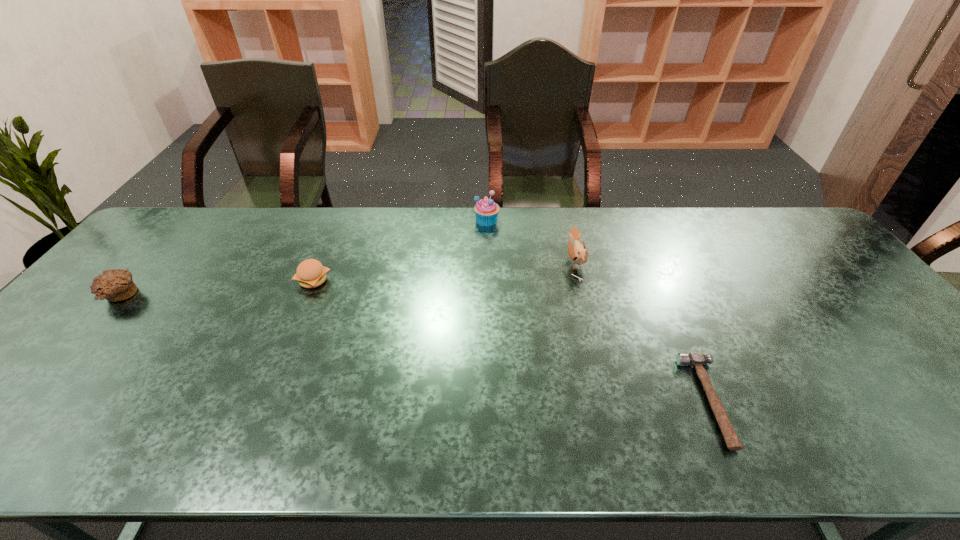
Locate an element on the screen. the farther muffin is located at coordinates (486, 210).

In order to click on the farthest object in this screenshot , I will do [x=486, y=210].

Where is `the second object from right to left`? Image resolution: width=960 pixels, height=540 pixels. the second object from right to left is located at coordinates (578, 253).

Find the location of `the leftmost object`. the leftmost object is located at coordinates (114, 285).

This screenshot has width=960, height=540. In order to click on the left muffin in this screenshot , I will do `click(114, 285)`.

The height and width of the screenshot is (540, 960). Identify the location of hamburger. (310, 273).

This screenshot has width=960, height=540. I want to click on the nearest object, so click(x=695, y=359).

Locate an element on the screen. This screenshot has width=960, height=540. the shortest object is located at coordinates (695, 359).

At what (x,y) coordinates should I click in order to perform the action: click on vacant space located 0.080m on the front of the farthest object. Please return your answer as a coordinate pair (x, y). Looking at the image, I should click on (488, 242).

This screenshot has width=960, height=540. What are the coordinates of `free region located at the beak of the bird` in the screenshot? It's located at (494, 262).